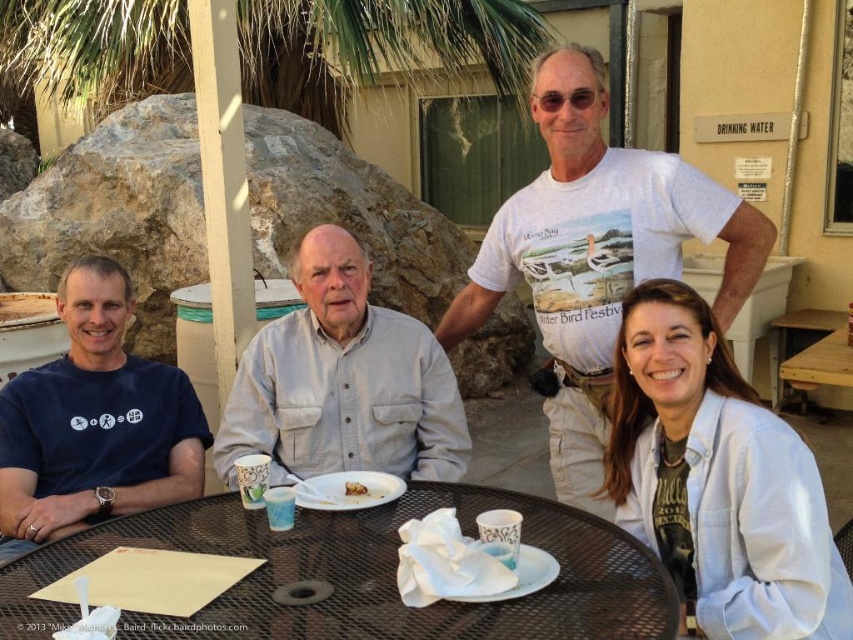
Question: Which of the following is the farthest from the observer?

Choices:
 (A) (822, 352)
 (B) (676, 356)

Answer: (A)

Question: Is white cotton t-shirt at upper center thinner than golden brown bread at center?

Choices:
 (A) no
 (B) yes

Answer: (A)

Question: Considering the real-world distances, which object is closest to the brown wooden table at lower right?

Choices:
 (A) white denim jacket at lower right
 (B) golden brown bread at center
 (C) gray cotton shirt at center

Answer: (A)

Question: Is white denim jacket at lower right further to the viewer compared to golden brown bread at center?

Choices:
 (A) no
 (B) yes

Answer: (A)

Question: Which of these objects is positioned farthest from the metallic round table at center?

Choices:
 (A) golden brown bread at center
 (B) white cotton t-shirt at upper center
 (C) blue cotton t-shirt at left
 (D) brown wooden table at lower right

Answer: (D)

Question: Is blue cotton t-shirt at left to the right of golden brown bread at center from the viewer's perspective?

Choices:
 (A) no
 (B) yes

Answer: (A)